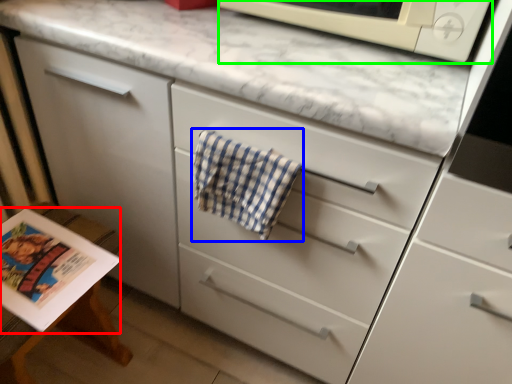
Question: Which object is positioned farthest from magazine (highlighted by a red box)? Select from beach towel (highlighted by a blue box) and microwave oven (highlighted by a green box).

Choices:
 (A) beach towel
 (B) microwave oven

Answer: (B)